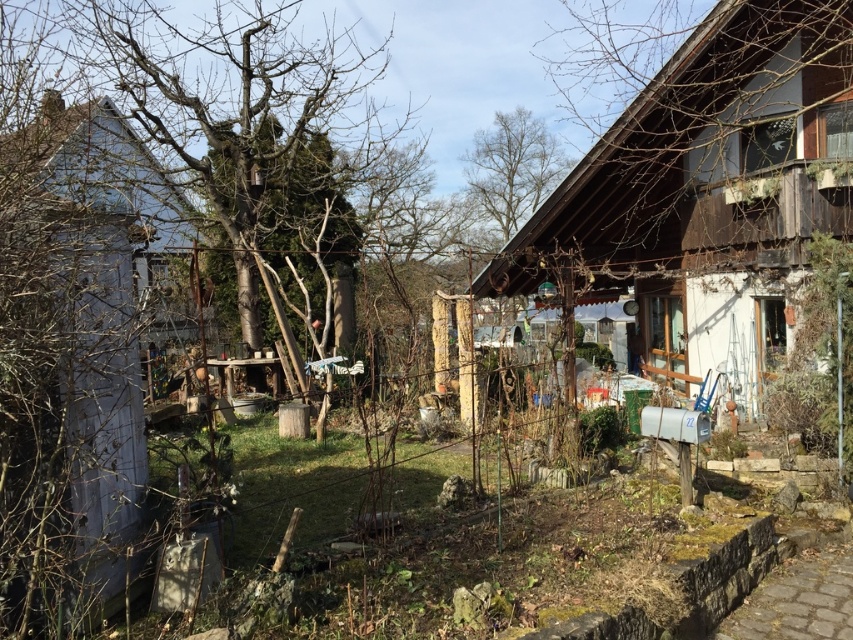
You are standing in the garden and notice the bare branches at left and the bare wood tree at upper center. Which one is taller?

The bare branches at left has a lesser height compared to the bare wood tree at upper center, so the bare wood tree at upper center is taller.

You are a visitor in the garden and want to take a photo of both the wooden hut at right and the bare wood tree at upper center in the same frame. Based on their heights, which object should you position closer to the camera to ensure both are fully visible?

The wooden hut at right is taller than the bare wood tree at upper center, so you should position the wooden hut at right closer to the camera to ensure both are fully visible.